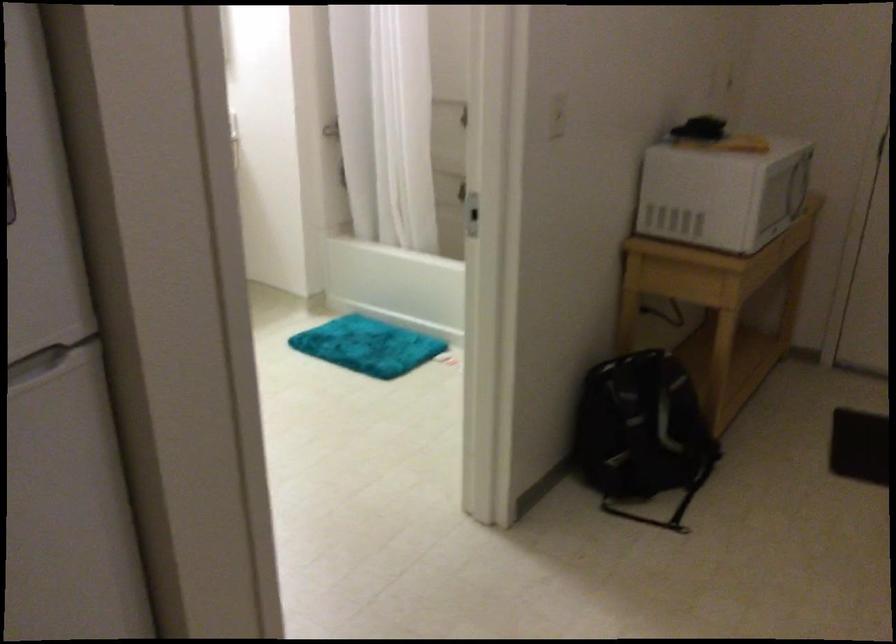
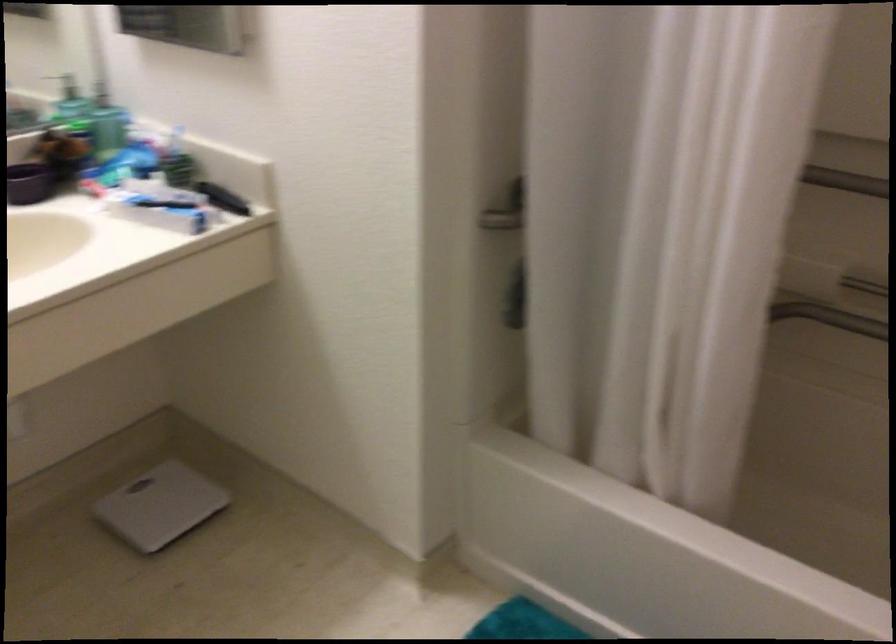
Question: What movement of the cameraman would produce the second image?

Choices:
 (A) Left
 (B) Right
 (C) Forward
 (D) Backward

Answer: (C)